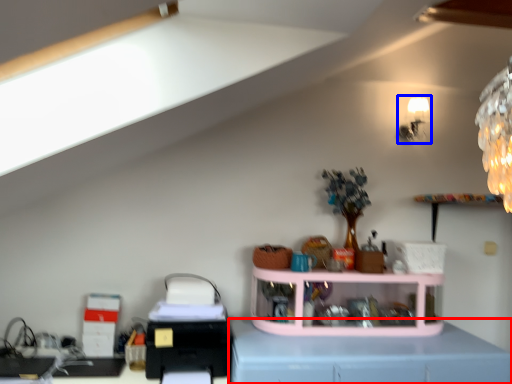
Question: Which object appears farthest to the camera in this image, computer desk (highlighted by a red box) or lamp (highlighted by a blue box)?

Choices:
 (A) computer desk
 (B) lamp

Answer: (B)